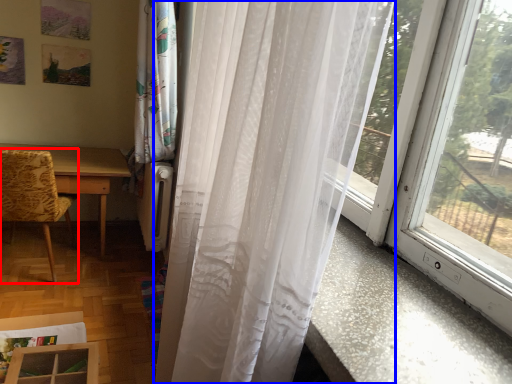
Question: Which of the following is the farthest to the observer, chair (highlighted by a red box) or curtain (highlighted by a blue box)?

Choices:
 (A) chair
 (B) curtain

Answer: (A)